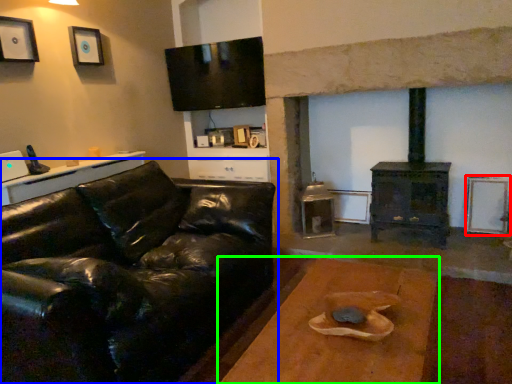
Question: Based on their relative distances, which object is farther from picture frame (highlighted by a red box)? Choose from studio couch (highlighted by a blue box) and table (highlighted by a green box).

Choices:
 (A) studio couch
 (B) table

Answer: (A)